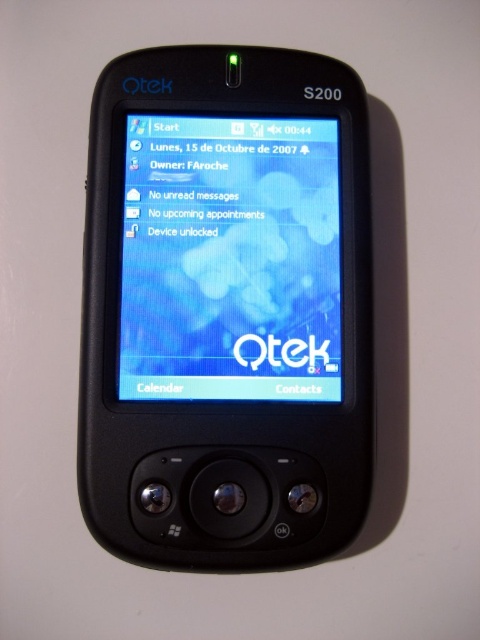
In the scene shown: Can you confirm if black matte smartphone at center is taller than matte plastic screen at center?

Yes, black matte smartphone at center is taller than matte plastic screen at center.

Does black matte smartphone at center appear over matte plastic screen at center?

Incorrect, black matte smartphone at center is not positioned above matte plastic screen at center.

Is point (289, 285) less distant than point (291, 266)?

Yes, point (289, 285) is in front of point (291, 266).

Where is `black matte smartphone at center`? black matte smartphone at center is located at coordinates click(227, 308).